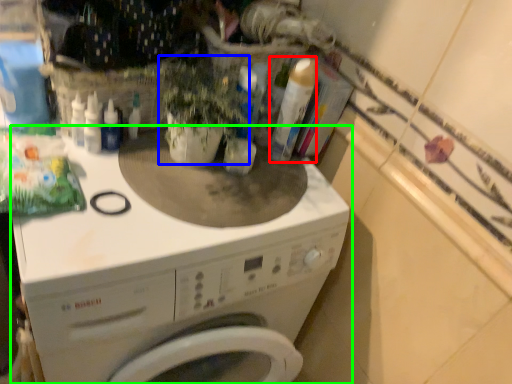
Question: Considering the real-world distances, which object is closest to cleaning product (highlighted by a red box)? plant (highlighted by a blue box) or washing machine (highlighted by a green box).

Choices:
 (A) plant
 (B) washing machine

Answer: (A)